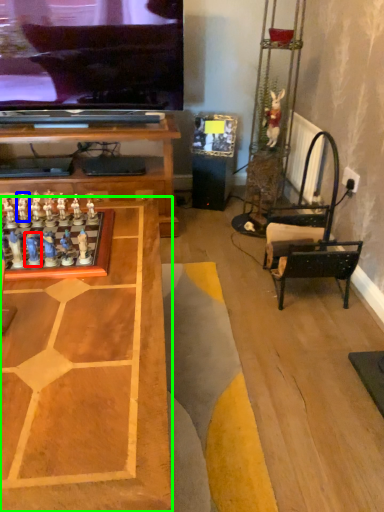
Question: Which object is positioned closest to toy (highlighted by a red box)? Select from toy (highlighted by a blue box) and table (highlighted by a green box).

Choices:
 (A) toy
 (B) table

Answer: (A)